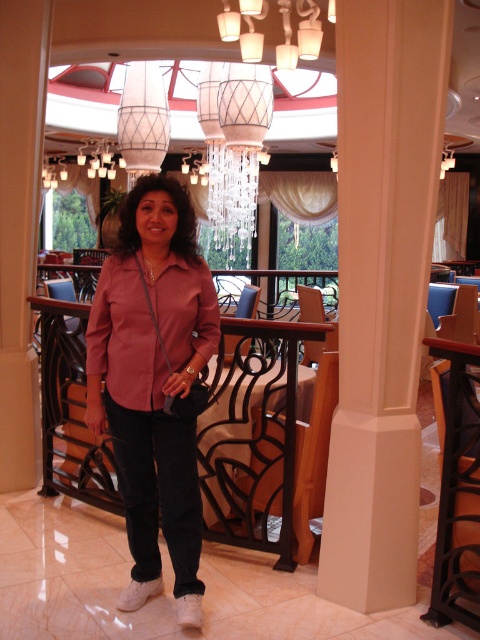
Question: Is the position of beige smooth column at center less distant than that of brown wrought iron at center?

Choices:
 (A) no
 (B) yes

Answer: (B)

Question: Which of the following is the closest to the observer?

Choices:
 (A) (96, 476)
 (B) (400, 467)

Answer: (B)

Question: Which object is closer to the camera taking this photo?

Choices:
 (A) brown wrought iron at center
 (B) pink satin blouse at center
 (C) matte glass chandelier at upper center

Answer: (B)

Question: Can you confirm if beige smooth column at center is positioned above matte glass chandelier at upper center?

Choices:
 (A) no
 (B) yes

Answer: (A)

Question: Is pink satin blouse at center below matte glass chandelier at upper center?

Choices:
 (A) yes
 (B) no

Answer: (A)

Question: Among these objects, which one is farthest from the camera?

Choices:
 (A) matte glass chandelier at upper center
 (B) pink satin blouse at center

Answer: (A)